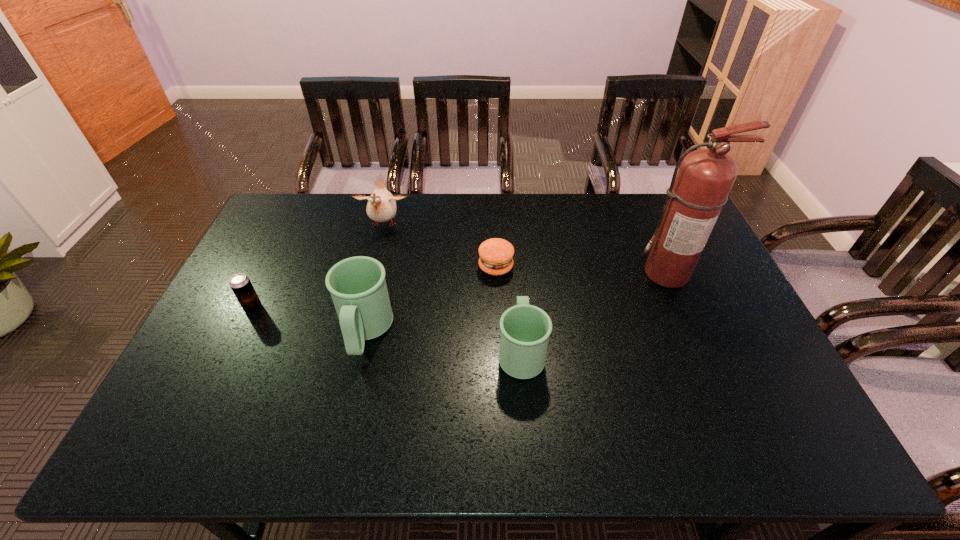
You are a GUI agent. You are given a task and a screenshot of the screen. Output one action in this format:
    pyautogui.click(x=<x>, y=<y>)
    Task: Click on the left mug
    The image size is (960, 540).
    Given the screenshot: What is the action you would take?
    pyautogui.click(x=357, y=285)

Where is `the shorter mug`? The width and height of the screenshot is (960, 540). the shorter mug is located at coordinates (525, 329).

What are the coordinates of `the farthest object` in the screenshot? It's located at (381, 207).

Find the location of a particular element. The image size is (960, 540). the tallest object is located at coordinates (698, 192).

I want to click on the rightmost object, so click(x=698, y=192).

This screenshot has width=960, height=540. Find the location of `the shortest object`. the shortest object is located at coordinates (496, 254).

You are a GUI agent. You are given a task and a screenshot of the screen. Output one action in this format:
    pyautogui.click(x=<x>, y=<y>)
    Task: Click on the fifth tallest object
    This screenshot has width=960, height=540.
    Given the screenshot: What is the action you would take?
    240,284

Locate an element on the screen. beer can is located at coordinates (240, 284).

This screenshot has height=540, width=960. In order to click on vacant space located on the side of the taller mug with the handle in this screenshot , I will do `click(351, 393)`.

Image resolution: width=960 pixels, height=540 pixels. In order to click on free space located on the side of the shorter mug with the handle in this screenshot , I will do [515, 271].